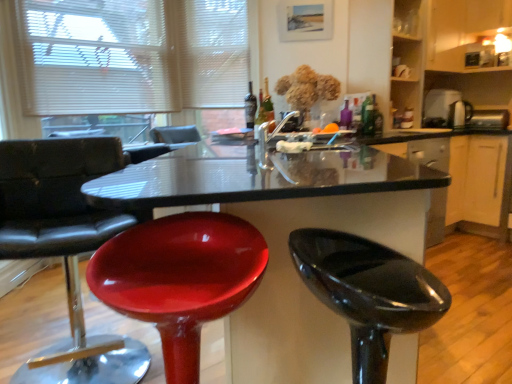
Identify the location of white matte blinds at upper left. Image resolution: width=512 pixels, height=384 pixels. (132, 55).

You are a GUI agent. You are given a task and a screenshot of the screen. Output one action in this format:
    pyautogui.click(x=<x>, y=<y>)
    Task: Click on the glossy black stool at lower right, the 1th chair viewed from the right
    The image size is (512, 384).
    Given the screenshot: What is the action you would take?
    pyautogui.click(x=368, y=292)

The height and width of the screenshot is (384, 512). I want to click on green glass bottle at upper center, which appears as the 3th bottle when viewed from the back, so click(x=261, y=112).

You are a GUI agent. You are given a task and a screenshot of the screen. Output one action in this format:
    pyautogui.click(x=<x>, y=<y>)
    Task: Click on the metallic silver toaster at upper right, which appears as the second appliance when viewed from the right
    Image resolution: width=512 pixels, height=384 pixels.
    Given the screenshot: What is the action you would take?
    pyautogui.click(x=439, y=108)

At what (x,y) coordinates should I click in order to perform the action: click on black glossy counter at right. Please return your answer as a coordinate pair (x, y). Image resolution: width=512 pixels, height=384 pixels. Looking at the image, I should click on (462, 178).

In the image, is matte glass bottle at center, placed as the 1th bottle when sorted from back to front, on the left side or the right side of purple glass bottle at upper center, which appears as the 3th bottle when viewed from the left?

matte glass bottle at center, placed as the 1th bottle when sorted from back to front, is to the left of purple glass bottle at upper center, which appears as the 3th bottle when viewed from the left.

In the scene shown: From the image's perspective, which one is positioned higher, matte glass bottle at center, which appears as the third bottle when viewed from the right, or purple glass bottle at upper center, the first bottle viewed from the right?

From the image's view, matte glass bottle at center, which appears as the third bottle when viewed from the right, is above.

Are matte glass bottle at center, which appears as the third bottle when viewed from the right, and purple glass bottle at upper center, the first bottle viewed from the right, far apart?

matte glass bottle at center, which appears as the third bottle when viewed from the right, is actually quite close to purple glass bottle at upper center, the first bottle viewed from the right.

In terms of size, does matte glass bottle at center, placed as the 1th bottle when sorted from back to front, appear bigger or smaller than purple glass bottle at upper center, positioned as the second bottle in front-to-back order?

Clearly, matte glass bottle at center, placed as the 1th bottle when sorted from back to front, is larger in size than purple glass bottle at upper center, positioned as the second bottle in front-to-back order.

Considering the positions of point (36, 144) and point (500, 223), is point (36, 144) closer or farther from the camera than point (500, 223)?

Point (36, 144).

In terms of height, does glossy plastic stool at left, the first chair in the left-to-right sequence, look taller or shorter compared to black glossy counter at right?

In the image, glossy plastic stool at left, the first chair in the left-to-right sequence, appears to be taller than black glossy counter at right.

Which is correct: glossy plastic stool at left, the first chair in the left-to-right sequence, is inside black glossy counter at right, or outside of it?

glossy plastic stool at left, the first chair in the left-to-right sequence, is outside black glossy counter at right.

From the picture: Can you confirm if glossy plastic stool at left, arranged as the third chair when viewed from the right, is thinner than black glossy counter at right?

Yes.

Is point (221, 259) positioned before point (457, 122)?

Yes, it is.

From a real-world perspective, is glossy plastic stool at center, the second chair viewed from the left, positioned above or below metallic silver toaster at upper right, placed as the 3th appliance when sorted from right to left?

Clearly, from a real-world perspective, glossy plastic stool at center, the second chair viewed from the left, is below metallic silver toaster at upper right, placed as the 3th appliance when sorted from right to left.

From the image's perspective, which object appears higher, glossy plastic stool at center, the second chair viewed from the left, or metallic silver toaster at upper right, marked as the first appliance in a left-to-right arrangement?

metallic silver toaster at upper right, marked as the first appliance in a left-to-right arrangement, from the image's perspective.

From the image's perspective, which is below, metallic silver toaster at right, which is counted as the 1th appliance, starting from the right, or black glossy counter at right?

black glossy counter at right appears lower in the image.

Does metallic silver toaster at right, which is counted as the 1th appliance, starting from the right, have a lesser width compared to black glossy counter at right?

Correct, the width of metallic silver toaster at right, which is counted as the 1th appliance, starting from the right, is less than that of black glossy counter at right.

Can you confirm if metallic silver toaster at right, acting as the third appliance starting from the left, is positioned to the right of black glossy counter at right?

Correct, you'll find metallic silver toaster at right, acting as the third appliance starting from the left, to the right of black glossy counter at right.

Considering the relative positions of metallic silver toaster at upper right, marked as the first appliance in a left-to-right arrangement, and white matte blinds at upper left in the image provided, is metallic silver toaster at upper right, marked as the first appliance in a left-to-right arrangement, to the right of white matte blinds at upper left from the viewer's perspective?

Yes, metallic silver toaster at upper right, marked as the first appliance in a left-to-right arrangement, is to the right of white matte blinds at upper left.

In the scene shown: Is metallic silver toaster at upper right, placed as the 3th appliance when sorted from right to left, completely or partially outside of white matte blinds at upper left?

metallic silver toaster at upper right, placed as the 3th appliance when sorted from right to left, is positioned outside white matte blinds at upper left.

Considering the positions of points (455, 104) and (37, 95), is point (455, 104) farther from camera compared to point (37, 95)?

Yes.

From a real-world perspective, who is located higher, metallic silver toaster at upper right, marked as the first appliance in a left-to-right arrangement, or white matte blinds at upper left?

From a 3D spatial view, white matte blinds at upper left is above.

From the image's perspective, is black glossy counter at right beneath glossy black stool at lower right, the 1th chair viewed from the right?

Incorrect, from the image's perspective, black glossy counter at right is higher than glossy black stool at lower right, the 1th chair viewed from the right.

From a real-world perspective, is black glossy counter at right positioned above or below glossy black stool at lower right, the 1th chair viewed from the right?

Clearly, from a real-world perspective, black glossy counter at right is below glossy black stool at lower right, the 1th chair viewed from the right.

Is black glossy counter at right in contact with glossy black stool at lower right, the 1th chair viewed from the right?

No, black glossy counter at right is not touching glossy black stool at lower right, the 1th chair viewed from the right.

Between black glossy counter at right and glossy black stool at lower right, arranged as the 3th chair when viewed from the left, which one has smaller size?

With smaller size is glossy black stool at lower right, arranged as the 3th chair when viewed from the left.

Does point (18, 255) come farther from viewer compared to point (425, 100)?

No, (18, 255) is closer to viewer.

Can you tell me how much glossy plastic stool at left, the first chair in the left-to-right sequence, and metallic silver toaster at upper right, which appears as the second appliance when viewed from the right, differ in facing direction?

There is a 18.7-degree angle between the facing directions of glossy plastic stool at left, the first chair in the left-to-right sequence, and metallic silver toaster at upper right, which appears as the second appliance when viewed from the right.

Does glossy plastic stool at left, arranged as the third chair when viewed from the right, have a greater height compared to metallic silver toaster at upper right, the 2th appliance from the left?

Indeed, glossy plastic stool at left, arranged as the third chair when viewed from the right, has a greater height compared to metallic silver toaster at upper right, the 2th appliance from the left.

Which of these two, glossy plastic stool at left, arranged as the third chair when viewed from the right, or metallic silver toaster at upper right, which appears as the second appliance when viewed from the right, is wider?

glossy plastic stool at left, arranged as the third chair when viewed from the right, is wider.

Find the location of a particular element. The width and height of the screenshot is (512, 384). bottle that is behind the purple glass bottle at upper center, positioned as the second bottle in front-to-back order is located at coordinates (250, 107).

Find the location of a particular element. Image resolution: width=512 pixels, height=384 pixels. counter above the glossy plastic stool at left, arranged as the third chair when viewed from the right (from the image's perspective) is located at coordinates (462, 178).

From the image, which object appears to be farther from glossy black stool at lower right, arranged as the 3th chair when viewed from the left, matte glass bottle at center, the first bottle viewed from the left, or metallic silver toaster at upper right, marked as the first appliance in a left-to-right arrangement?

Among the two, metallic silver toaster at upper right, marked as the first appliance in a left-to-right arrangement, is located further to glossy black stool at lower right, arranged as the 3th chair when viewed from the left.

Based on the photo, based on their spatial positions, is glossy plastic stool at center, the second chair viewed from the left, or black glossy counter at right further from matte glass bottle at center, which is counted as the third bottle, starting from the front?

Among the two, glossy plastic stool at center, the second chair viewed from the left, is located further to matte glass bottle at center, which is counted as the third bottle, starting from the front.

Considering their positions, is purple glass bottle at upper center, the first bottle viewed from the right, positioned closer to glossy plastic stool at center, the second chair in the right-to-left sequence, than glossy black stool at lower right, arranged as the 3th chair when viewed from the left?

glossy black stool at lower right, arranged as the 3th chair when viewed from the left, lies closer to glossy plastic stool at center, the second chair in the right-to-left sequence, than the other object.

From the image, which object appears to be nearer to matte glass bottle at center, placed as the 1th bottle when sorted from back to front, green glass wine bottle at center or metallic silver toaster at upper right, placed as the 3th appliance when sorted from right to left?

Based on the image, green glass wine bottle at center appears to be nearer to matte glass bottle at center, placed as the 1th bottle when sorted from back to front.

Looking at the image, which one is located closer to metallic silver toaster at upper right, marked as the first appliance in a left-to-right arrangement, purple glass bottle at upper center, positioned as the second bottle in front-to-back order, or glossy black stool at lower right, the 1th chair viewed from the right?

purple glass bottle at upper center, positioned as the second bottle in front-to-back order, lies closer to metallic silver toaster at upper right, marked as the first appliance in a left-to-right arrangement, than the other object.

Estimate the real-world distances between objects in this image. Which object is closer to metallic silver toaster at upper right, which appears as the second appliance when viewed from the right, white matte blinds at upper left or metallic silver toaster at upper right, marked as the first appliance in a left-to-right arrangement?

metallic silver toaster at upper right, marked as the first appliance in a left-to-right arrangement, is closer to metallic silver toaster at upper right, which appears as the second appliance when viewed from the right.

Which object lies further to the anchor point glossy plastic stool at center, the second chair viewed from the left, metallic silver toaster at right, acting as the third appliance starting from the left, or black glossy counter at right?

metallic silver toaster at right, acting as the third appliance starting from the left, is further to glossy plastic stool at center, the second chair viewed from the left.

Looking at this image, when comparing their distances from purple glass bottle at upper center, positioned as the second bottle in front-to-back order, does metallic silver toaster at upper right, the 2th appliance from the left, or black glossy counter at right seem further?

metallic silver toaster at upper right, the 2th appliance from the left, lies further to purple glass bottle at upper center, positioned as the second bottle in front-to-back order, than the other object.

Locate an element on the screen. The width and height of the screenshot is (512, 384). wine bottle between glossy black stool at lower right, arranged as the 3th chair when viewed from the left, and black glossy counter at right from front to back is located at coordinates (266, 105).

Identify the location of counter positioned between glossy plastic stool at center, the second chair viewed from the left, and metallic silver toaster at right, acting as the third appliance starting from the left, from near to far. The image size is (512, 384). (462, 178).

Where is `counter between glossy plastic table at center and metallic silver toaster at upper right, placed as the 3th appliance when sorted from right to left, in the front-back direction`? Image resolution: width=512 pixels, height=384 pixels. counter between glossy plastic table at center and metallic silver toaster at upper right, placed as the 3th appliance when sorted from right to left, in the front-back direction is located at coordinates tap(462, 178).

Find the location of `kitchen & dining room table between glossy plastic stool at center, the second chair viewed from the left, and black glossy counter at right, along the z-axis`. kitchen & dining room table between glossy plastic stool at center, the second chair viewed from the left, and black glossy counter at right, along the z-axis is located at coordinates (286, 237).